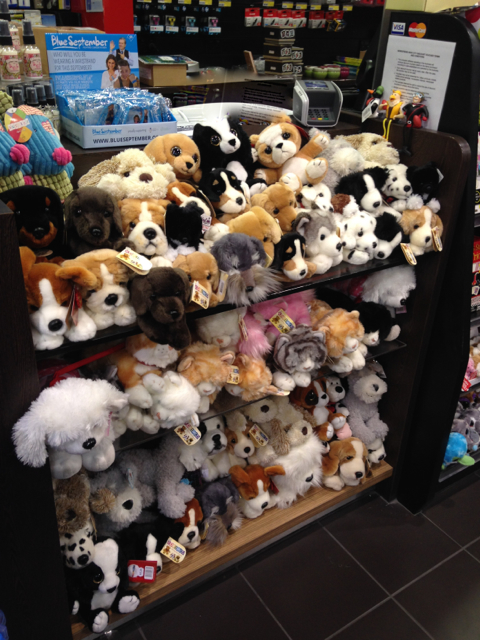
The image size is (480, 640). I want to click on empty space bottom right of stuffed animals, so click(351, 596).